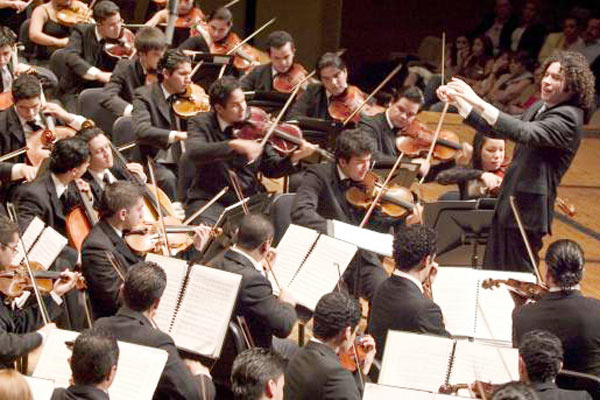
Find the location of a particular element. The width and height of the screenshot is (600, 400). scrolls is located at coordinates (570, 211), (487, 282), (441, 390), (220, 233), (86, 280), (87, 126), (49, 133).